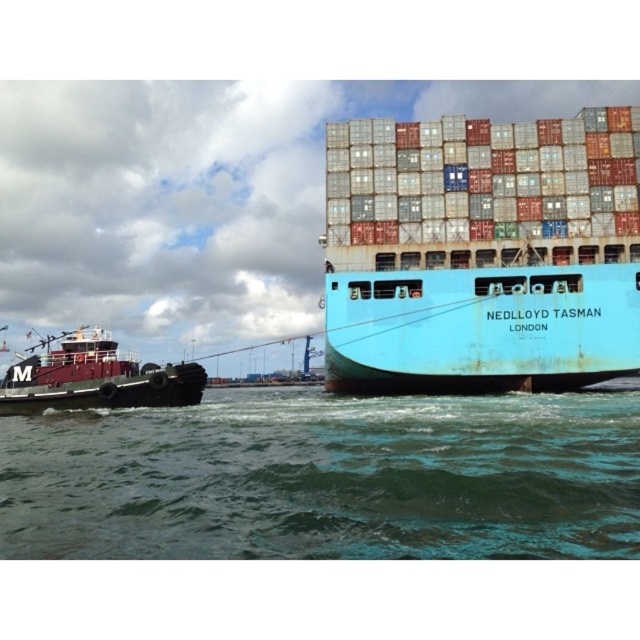
You are a marine engineer assessing the safety of a docking operation. The green water at lower center is part of a channel where the minimum safe distance between vessels is 20 meters. Can the blue matte container ship at center safely dock without violating this regulation?

The distance between the green water at lower center and the blue matte container ship at center is 16.86 meters, which is less than the required 20 meters. Therefore, the blue matte container ship at center cannot safely dock without violating the regulation.